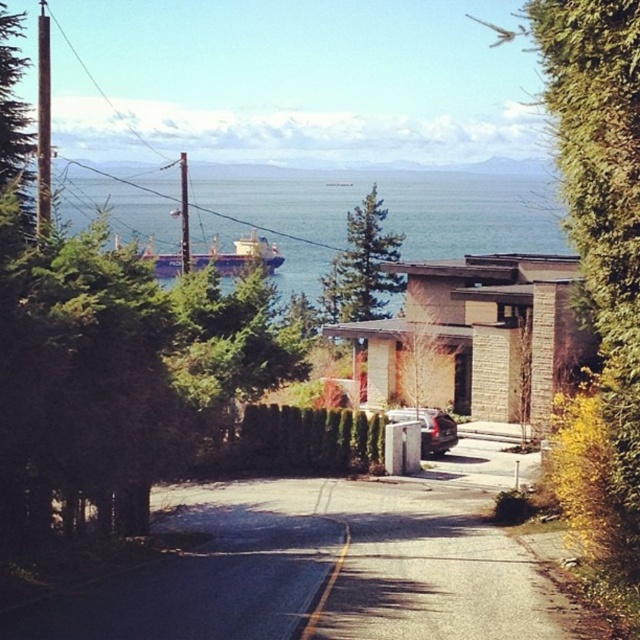
Can you confirm if blue metallic water at upper center is positioned below metallic silver car at center?

Incorrect, blue metallic water at upper center is not positioned below metallic silver car at center.

Between blue metallic water at upper center and metallic silver car at center, which one appears on the left side from the viewer's perspective?

blue metallic water at upper center is more to the left.

The height and width of the screenshot is (640, 640). What do you see at coordinates (403, 211) in the screenshot? I see `blue metallic water at upper center` at bounding box center [403, 211].

Find the location of a particular element. This screenshot has height=640, width=640. blue metallic water at upper center is located at coordinates tap(403, 211).